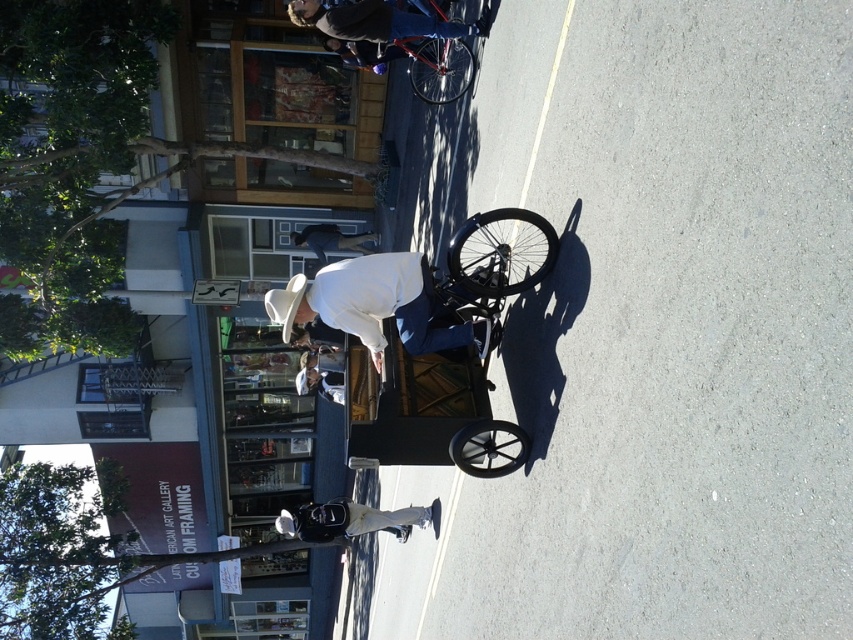
Between metallic blue bicycle at upper center and dark blue jeans at center, which one is positioned higher?

metallic blue bicycle at upper center

Between metallic blue bicycle at upper center and dark blue jeans at center, which one has less height?

With less height is dark blue jeans at center.

Is point (318, 19) in front of point (302, 241)?

Yes, it is in front of point (302, 241).

Locate an element on the screen. metallic blue bicycle at upper center is located at coordinates (379, 20).

Can you confirm if white matte hat at upper center is smaller than white matte cowboy hat at lower center?

Correct, white matte hat at upper center occupies less space than white matte cowboy hat at lower center.

Which is in front, point (405, 275) or point (408, 522)?

Point (405, 275)

Is point (396, 289) positioned before point (357, 524)?

That is True.

At what (x,y) coordinates should I click in order to perform the action: click on white matte hat at upper center. Please return your answer as a coordinate pair (x, y). This screenshot has height=640, width=853. Looking at the image, I should click on (376, 305).

Does white matte hat at upper center appear on the right side of shiny red bicycle at center?

Incorrect, white matte hat at upper center is not on the right side of shiny red bicycle at center.

Identify the location of white matte hat at upper center. (376, 305).

In order to click on white matte hat at upper center in this screenshot , I will do `click(376, 305)`.